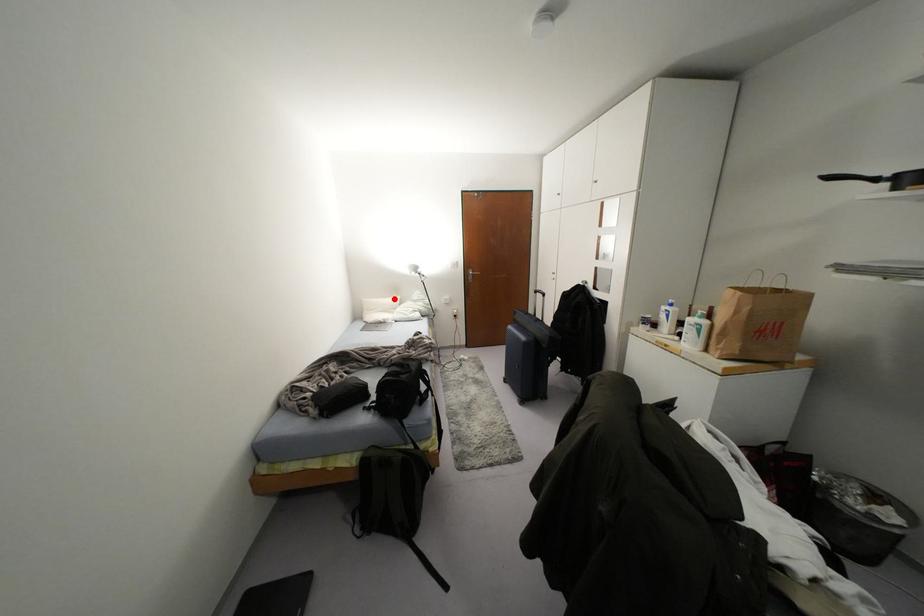
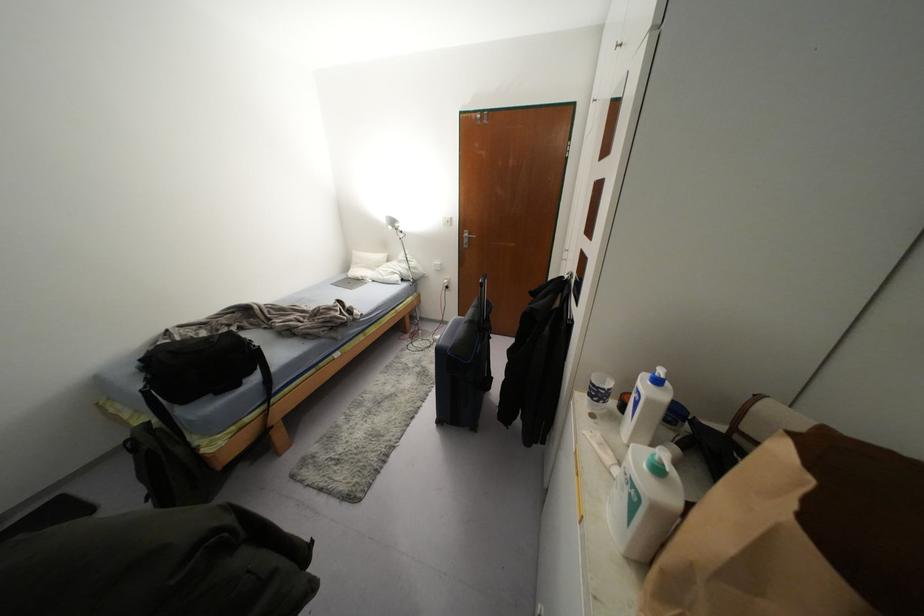
In the second image, find the point that corresponds to the highlighted location in the first image.

(382, 256)